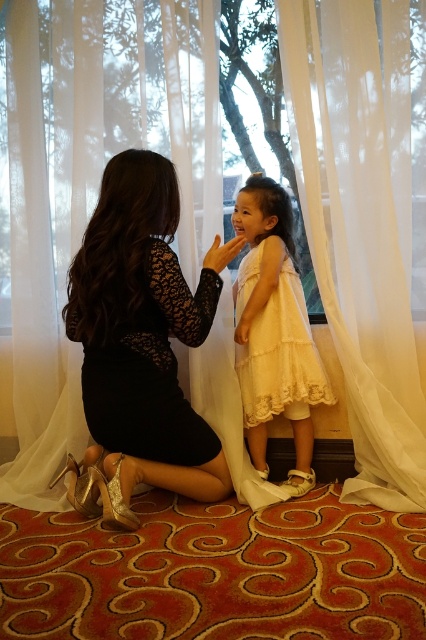
Can you confirm if white sheer curtain at center is positioned to the left of black lace dress at center?

In fact, white sheer curtain at center is to the right of black lace dress at center.

Is white sheer curtain at center shorter than black lace dress at center?

In fact, white sheer curtain at center may be taller than black lace dress at center.

Who is more distant from viewer, (377, 68) or (123, 356)?

Point (377, 68)

Locate an element on the screen. white sheer curtain at center is located at coordinates (356, 240).

Which is behind, point (163, 342) or point (287, 372)?

Positioned behind is point (287, 372).

Based on the photo, does black lace dress at center appear on the right side of yellow lace dress at center?

Incorrect, black lace dress at center is not on the right side of yellow lace dress at center.

You are a GUI agent. You are given a task and a screenshot of the screen. Output one action in this format:
    pyautogui.click(x=<x>, y=<y>)
    Task: Click on the black lace dress at center
    
    Given the screenshot: What is the action you would take?
    pyautogui.click(x=150, y=368)

This screenshot has width=426, height=640. What do you see at coordinates (356, 240) in the screenshot?
I see `white sheer curtain at center` at bounding box center [356, 240].

Which is in front, point (412, 483) or point (313, 353)?

Point (412, 483) is in front.

Where is `white sheer curtain at center`? white sheer curtain at center is located at coordinates (356, 240).